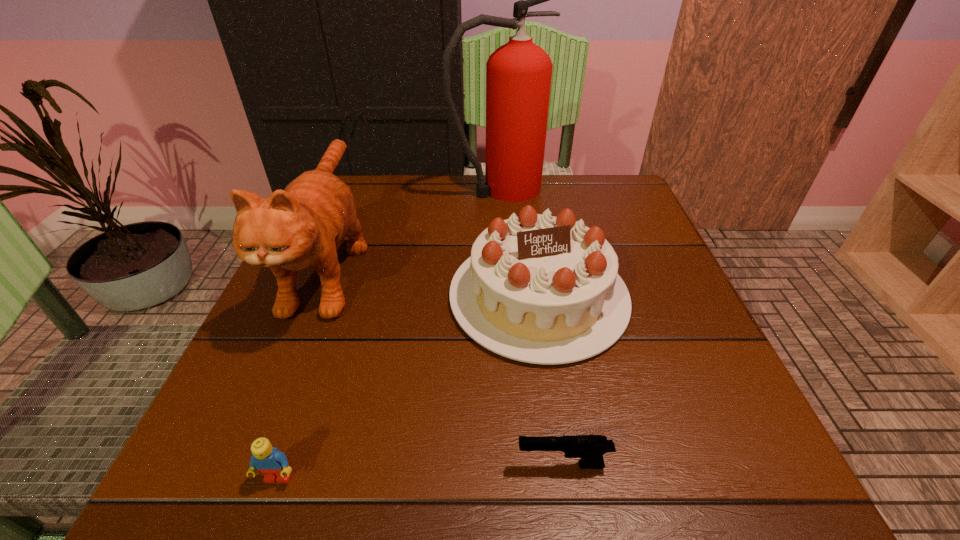
I want to click on object situated at the near left corner, so click(x=273, y=464).

Where is `free point at the far edge`? This screenshot has height=540, width=960. free point at the far edge is located at coordinates (421, 201).

Where is `free spot at the near edge of the desktop`? The height and width of the screenshot is (540, 960). free spot at the near edge of the desktop is located at coordinates (322, 498).

The width and height of the screenshot is (960, 540). What are the coordinates of `blank space at the left edge of the desktop` in the screenshot? It's located at (277, 390).

The image size is (960, 540). Identify the location of vacant space at the right edge of the desktop. (708, 406).

You are a GUI agent. You are given a task and a screenshot of the screen. Output one action in this format:
    pyautogui.click(x=<x>, y=<y>)
    Task: Click on the vacant space at the near left corner
    This screenshot has width=960, height=540.
    Given the screenshot: What is the action you would take?
    pyautogui.click(x=220, y=455)

In the image, there is a desktop. At what (x,y) coordinates should I click in order to perform the action: click on free space at the far right corner. Please return your answer as a coordinate pair (x, y). Looking at the image, I should click on (569, 182).

You are a GUI agent. You are given a task and a screenshot of the screen. Output one action in this format:
    pyautogui.click(x=<x>, y=<y>)
    Task: Click on the free region at the near right corner of the desktop
    
    Given the screenshot: What is the action you would take?
    pyautogui.click(x=689, y=476)

You are a GUI agent. You are given a task and a screenshot of the screen. Output one action in this format:
    pyautogui.click(x=<x>, y=<y>)
    Task: Click on the unoccupied position between the tallest object and the second shortest object
    Image resolution: width=960 pixels, height=540 pixels.
    Given the screenshot: What is the action you would take?
    pyautogui.click(x=389, y=333)

Where is `free area in between the fourth shortest object and the birthday cake`? free area in between the fourth shortest object and the birthday cake is located at coordinates (434, 280).